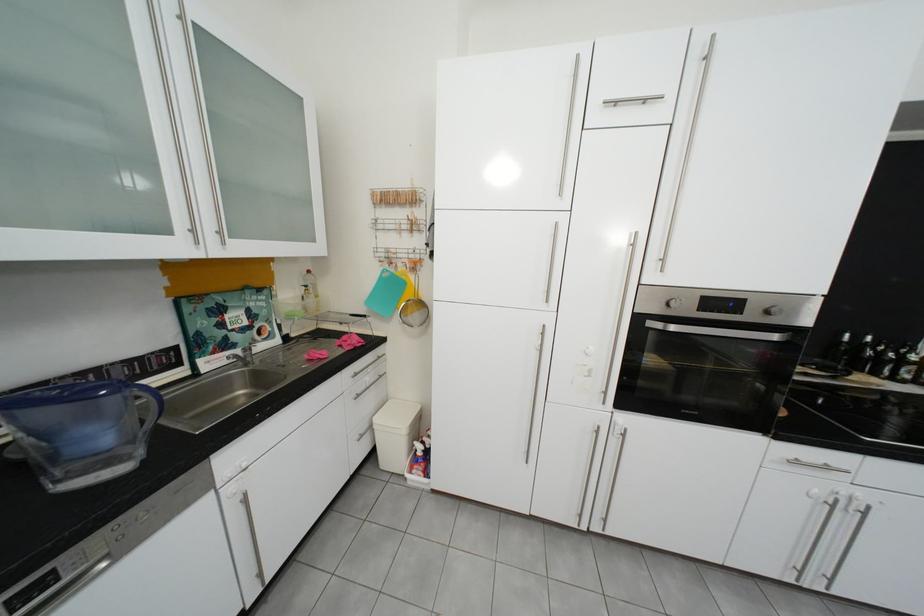
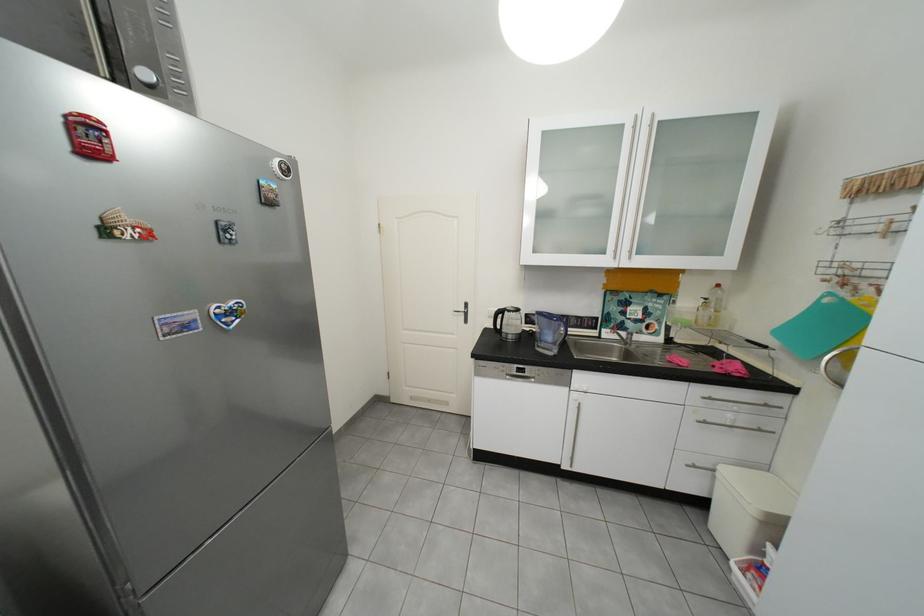
Find the pixel in the second image that matches (x=224, y=363) in the first image.

(619, 334)